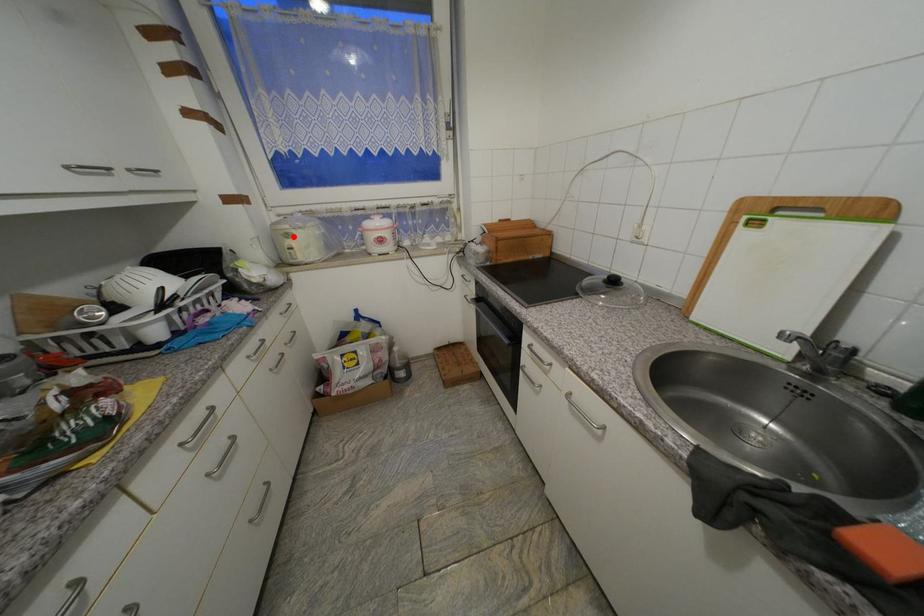
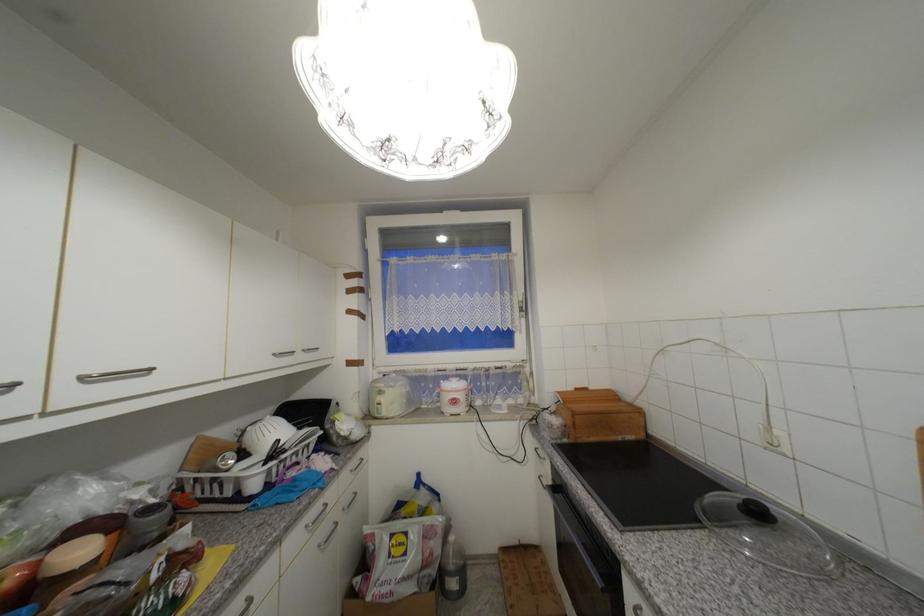
Question: I am providing you with two images of the same scene from different viewpoints. In image1, a red point is highlighted. Considering the same 3D point in image2, which of the following is correct?

Choices:
 (A) It is closer
 (B) It is farther

Answer: (B)